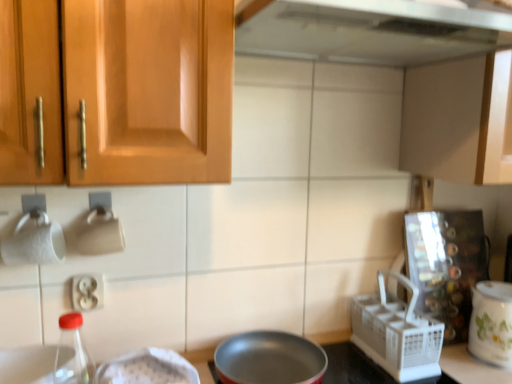
Question: From the image's perspective, is white ceramic pot at right located beneath white plastic basket at right?

Choices:
 (A) no
 (B) yes

Answer: (B)

Question: Is white ceramic pot at right facing away from white plastic basket at right?

Choices:
 (A) yes
 (B) no

Answer: (B)

Question: Is white plastic basket at right surrounded by white ceramic pot at right?

Choices:
 (A) yes
 (B) no

Answer: (B)

Question: Does white ceramic pot at right have a lesser width compared to white plastic basket at right?

Choices:
 (A) yes
 (B) no

Answer: (A)

Question: Is white ceramic pot at right located outside white plastic basket at right?

Choices:
 (A) no
 (B) yes

Answer: (B)

Question: Is white ceramic pot at right bigger than white plastic basket at right?

Choices:
 (A) no
 (B) yes

Answer: (A)

Question: Is white plastic electrical outlet at lower left in front of transparent glass bottle at lower left?

Choices:
 (A) yes
 (B) no

Answer: (B)

Question: Is white plastic electrical outlet at lower left surrounding transparent glass bottle at lower left?

Choices:
 (A) no
 (B) yes

Answer: (A)

Question: Considering the relative sizes of white plastic electrical outlet at lower left and transparent glass bottle at lower left in the image provided, is white plastic electrical outlet at lower left bigger than transparent glass bottle at lower left?

Choices:
 (A) no
 (B) yes

Answer: (A)

Question: Considering the relative sizes of white plastic electrical outlet at lower left and transparent glass bottle at lower left in the image provided, is white plastic electrical outlet at lower left shorter than transparent glass bottle at lower left?

Choices:
 (A) no
 (B) yes

Answer: (B)

Question: Considering the relative sizes of white plastic electrical outlet at lower left and transparent glass bottle at lower left in the image provided, is white plastic electrical outlet at lower left thinner than transparent glass bottle at lower left?

Choices:
 (A) yes
 (B) no

Answer: (A)

Question: From the image's perspective, is white plastic electrical outlet at lower left located beneath transparent glass bottle at lower left?

Choices:
 (A) no
 (B) yes

Answer: (A)

Question: From a real-world perspective, is transparent glass bottle at lower left located higher than white plastic basket at right?

Choices:
 (A) no
 (B) yes

Answer: (B)